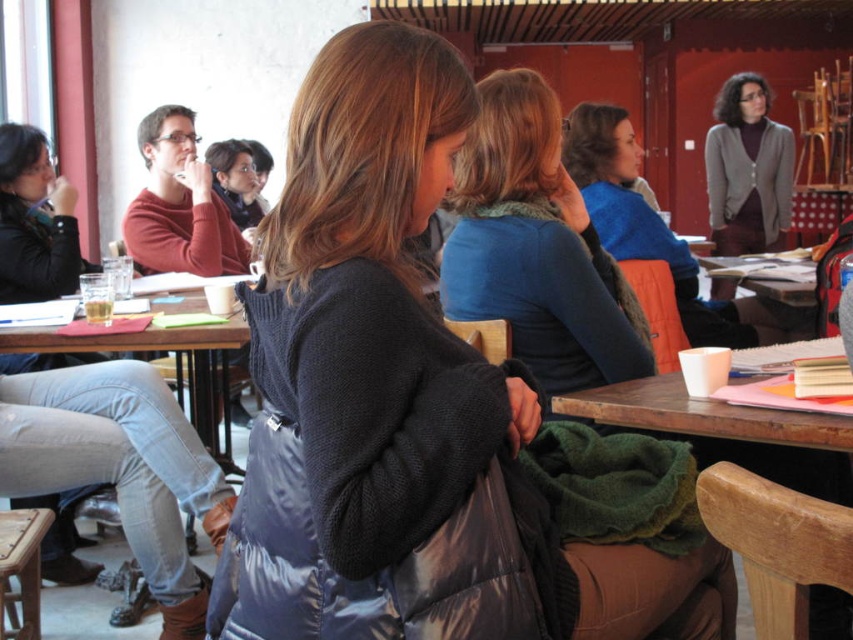
Question: Is denim jeans at lower left thinner than blue sweater at upper center?

Choices:
 (A) yes
 (B) no

Answer: (A)

Question: Is wooden table at lower right positioned behind knit cardigan at upper right?

Choices:
 (A) no
 (B) yes

Answer: (A)

Question: Which of the following is the closest to the observer?

Choices:
 (A) (144, 579)
 (B) (426, 40)
 (C) (735, 230)
 (D) (637, 385)

Answer: (B)

Question: Based on their relative distances, which object is farther from the blue sweater at upper center?

Choices:
 (A) white matte cup at lower center
 (B) wooden table at lower left
 (C) denim jeans at lower left

Answer: (C)

Question: Based on their relative distances, which object is nearer to the blue fuzzy sweater at center?

Choices:
 (A) denim jeans at lower left
 (B) wooden table at lower right

Answer: (B)

Question: Can you confirm if denim jeans at lower left is wider than blue sweater at upper center?

Choices:
 (A) no
 (B) yes

Answer: (A)